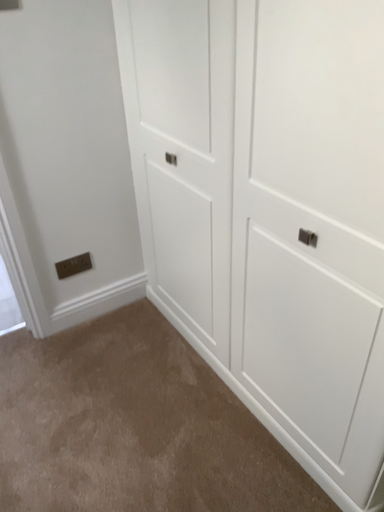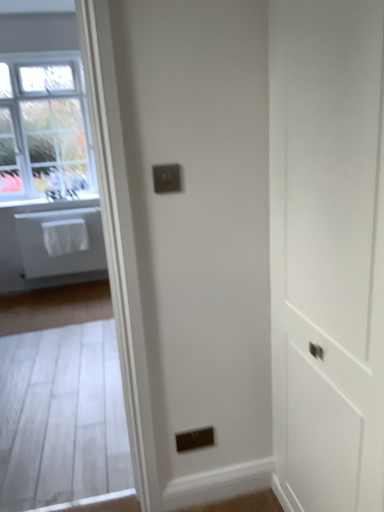
Question: How did the camera likely rotate when shooting the video?

Choices:
 (A) rotated downward
 (B) rotated upward

Answer: (B)